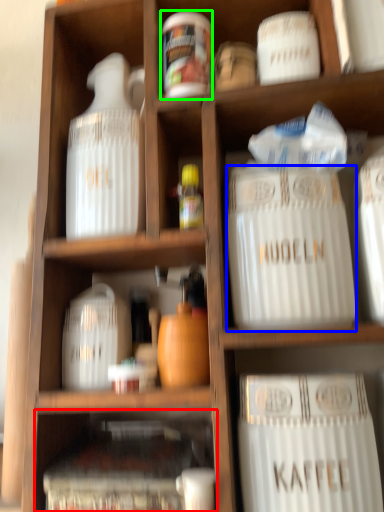
Question: Which object is the farthest from cabinet (highlighted by a red box)? Choose among these: type (highlighted by a blue box) or pottery (highlighted by a green box).

Choices:
 (A) type
 (B) pottery

Answer: (B)